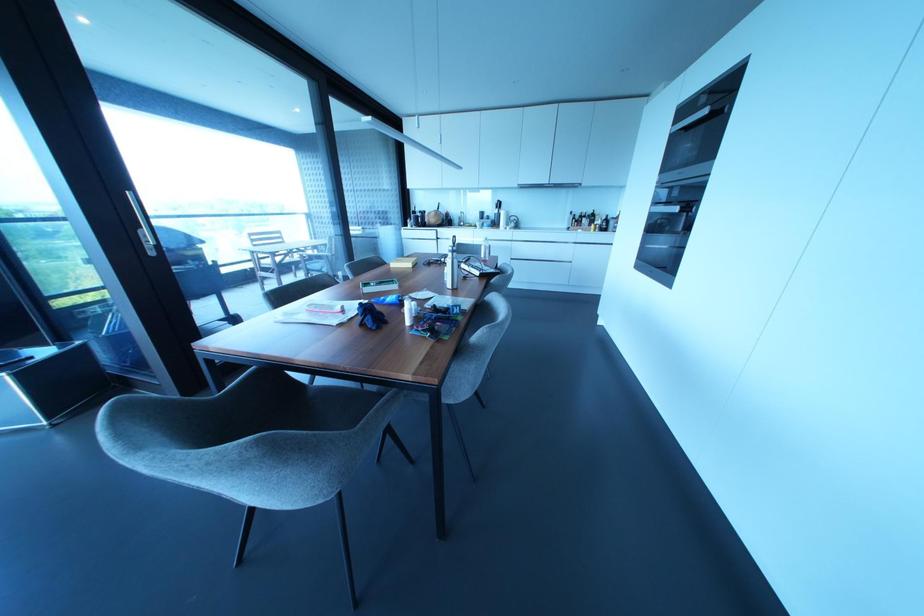
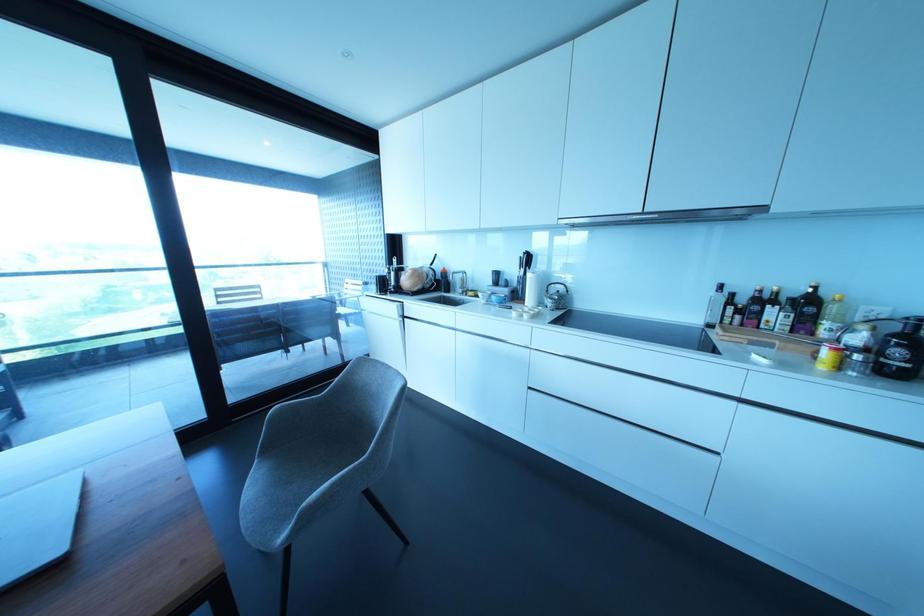
The point at (591, 216) is marked in the first image. Where is the corresponding point in the second image?

(807, 304)